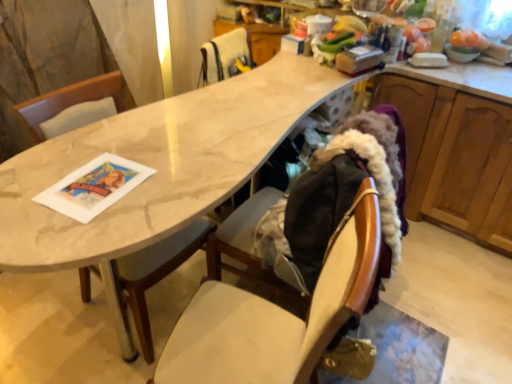
This screenshot has height=384, width=512. In order to click on empty space that is ontop of white fur at upper center, the 1th chair from the back (from a real-world perspective) in this screenshot , I will do `click(226, 37)`.